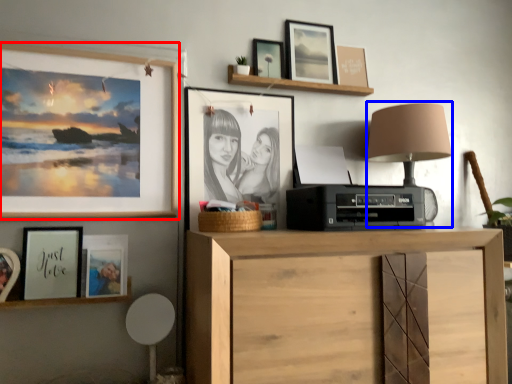
Question: Among these objects, which one is nearest to the camera, picture frame (highlighted by a red box) or table lamp (highlighted by a blue box)?

Choices:
 (A) picture frame
 (B) table lamp

Answer: (A)